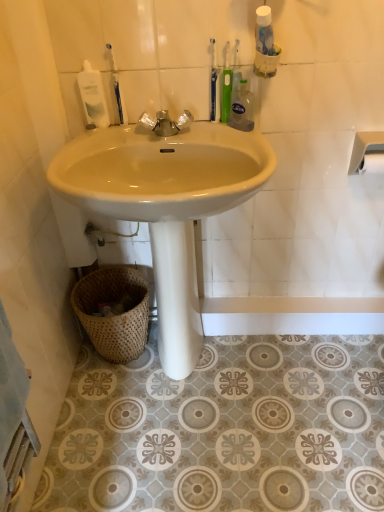
The image size is (384, 512). Describe the element at coordinates (166, 123) in the screenshot. I see `matte silver faucet at center` at that location.

Describe the element at coordinates (166, 205) in the screenshot. This screenshot has width=384, height=512. I see `matte ceramic sink at center` at that location.

At what (x,y) coordinates should I click in order to perform the action: click on clear liquid soap at upper center. Please return your answer as a coordinate pair (x, y). The image size is (384, 512). Looking at the image, I should click on (242, 108).

Looking at this image, does clear liquid soap at upper center appear on the left side of blue plastic toothbrush at upper left, marked as the first toothbrush in a left-to-right arrangement?

No, clear liquid soap at upper center is not to the left of blue plastic toothbrush at upper left, marked as the first toothbrush in a left-to-right arrangement.

Does clear liquid soap at upper center have a smaller size compared to blue plastic toothbrush at upper left, marked as the first toothbrush in a left-to-right arrangement?

No, clear liquid soap at upper center is not smaller than blue plastic toothbrush at upper left, marked as the first toothbrush in a left-to-right arrangement.

How much distance is there between clear liquid soap at upper center and blue plastic toothbrush at upper left, which ranks as the fourth toothbrush in right-to-left order?

14.19 inches.

Can you tell me how much clear liquid soap at upper center and blue plastic toothbrush at upper left, which ranks as the fourth toothbrush in right-to-left order, differ in facing direction?

48.4 degrees separate the facing orientations of clear liquid soap at upper center and blue plastic toothbrush at upper left, which ranks as the fourth toothbrush in right-to-left order.

How different are the orientations of clear liquid soap at upper center and green plastic toothbrush at upper center, positioned as the 2th toothbrush in right-to-left order, in degrees?

The facing directions of clear liquid soap at upper center and green plastic toothbrush at upper center, positioned as the 2th toothbrush in right-to-left order, are 44.9 degrees apart.

Is clear liquid soap at upper center positioned with its back to green plastic toothbrush at upper center, the third toothbrush when ordered from left to right?

No, clear liquid soap at upper center is not facing away from green plastic toothbrush at upper center, the third toothbrush when ordered from left to right.

Would you say clear liquid soap at upper center is outside green plastic toothbrush at upper center, positioned as the 2th toothbrush in right-to-left order?

Yes, clear liquid soap at upper center is outside of green plastic toothbrush at upper center, positioned as the 2th toothbrush in right-to-left order.

Is clear liquid soap at upper center closer to camera compared to green plastic toothbrush at upper center, positioned as the 2th toothbrush in right-to-left order?

Yes, clear liquid soap at upper center is closer to the viewer.

Which is nearer, (376, 156) or (234, 68)?

Point (376, 156).

Between white matte toilet paper at right and green plastic toothbrush at upper center, which is the 4th toothbrush from left to right, which one appears on the left side from the viewer's perspective?

green plastic toothbrush at upper center, which is the 4th toothbrush from left to right.

From a real-world perspective, is white matte toilet paper at right positioned over green plastic toothbrush at upper center, positioned as the 1th toothbrush in right-to-left order, based on gravity?

No, from a real-world perspective, white matte toilet paper at right is not over green plastic toothbrush at upper center, positioned as the 1th toothbrush in right-to-left order

Considering the relative sizes of blue plastic toothbrush at upper left, marked as the first toothbrush in a left-to-right arrangement, and clear liquid soap at upper center in the image provided, is blue plastic toothbrush at upper left, marked as the first toothbrush in a left-to-right arrangement, shorter than clear liquid soap at upper center?

No, blue plastic toothbrush at upper left, marked as the first toothbrush in a left-to-right arrangement, is not shorter than clear liquid soap at upper center.

Can you tell me how much blue plastic toothbrush at upper left, which ranks as the fourth toothbrush in right-to-left order, and clear liquid soap at upper center differ in facing direction?

The angle between the facing direction of blue plastic toothbrush at upper left, which ranks as the fourth toothbrush in right-to-left order, and the facing direction of clear liquid soap at upper center is 48.4 degrees.

Could you measure the distance between blue plastic toothbrush at upper left, marked as the first toothbrush in a left-to-right arrangement, and clear liquid soap at upper center?

blue plastic toothbrush at upper left, marked as the first toothbrush in a left-to-right arrangement, is 14.19 inches away from clear liquid soap at upper center.

From the image's perspective, between blue plastic toothbrush at upper left, marked as the first toothbrush in a left-to-right arrangement, and clear liquid soap at upper center, who is located below?

clear liquid soap at upper center appears lower in the image.

Considering the relative sizes of matte silver faucet at center and woven brown basket at lower left in the image provided, is matte silver faucet at center thinner than woven brown basket at lower left?

Correct, the width of matte silver faucet at center is less than that of woven brown basket at lower left.

Does matte silver faucet at center appear on the right side of woven brown basket at lower left?

Correct, you'll find matte silver faucet at center to the right of woven brown basket at lower left.

Does matte silver faucet at center turn towards woven brown basket at lower left?

No, matte silver faucet at center does not turn towards woven brown basket at lower left.

Which object is closer to the camera, matte silver faucet at center or woven brown basket at lower left?

matte silver faucet at center is closer to the camera.

Does blue plastic toothbrush at upper center, the third toothbrush from the right, have a larger size compared to clear liquid soap at upper center?

No.

Between blue plastic toothbrush at upper center, which is the second toothbrush from left to right, and clear liquid soap at upper center, which one appears on the right side from the viewer's perspective?

From the viewer's perspective, clear liquid soap at upper center appears more on the right side.

This screenshot has height=512, width=384. In order to click on the 2nd toothbrush directly above the clear liquid soap at upper center (from a real-world perspective) in this screenshot , I will do `click(214, 85)`.

Considering the relative sizes of matte silver faucet at center and green plastic toothbrush at upper center, the third toothbrush when ordered from left to right, in the image provided, is matte silver faucet at center thinner than green plastic toothbrush at upper center, the third toothbrush when ordered from left to right,?

No.

From a real-world perspective, who is located lower, matte silver faucet at center or green plastic toothbrush at upper center, the third toothbrush when ordered from left to right?

matte silver faucet at center is physically lower.

Is matte silver faucet at center looking in the opposite direction of green plastic toothbrush at upper center, positioned as the 2th toothbrush in right-to-left order?

No.

Is matte silver faucet at center to the left of green plastic toothbrush at upper center, positioned as the 2th toothbrush in right-to-left order, from the viewer's perspective?

Yes.

The width and height of the screenshot is (384, 512). In order to click on the 1st toothbrush directly above the clear liquid soap at upper center (from a real-world perspective) in this screenshot , I will do `click(115, 90)`.

I want to click on cleaning product below the green plastic toothbrush at upper center, the third toothbrush when ordered from left to right (from a real-world perspective), so click(242, 108).

Based on their spatial positions, is green plastic toothbrush at upper center, the third toothbrush when ordered from left to right, or matte ceramic sink at center closer to white matte toilet paper at right?

green plastic toothbrush at upper center, the third toothbrush when ordered from left to right, is closer to white matte toilet paper at right.

From the picture: When comparing their distances from blue plastic toothbrush at upper center, the third toothbrush from the right, does matte silver faucet at center or white plastic towel bar at upper right seem further?

The object further to blue plastic toothbrush at upper center, the third toothbrush from the right, is white plastic towel bar at upper right.

Looking at this image, estimate the real-world distances between objects in this image. Which object is further from white matte toilet paper at right, green plastic toothbrush at upper center, positioned as the 2th toothbrush in right-to-left order, or white glossy mouthwash at upper left?

white glossy mouthwash at upper left.

From the image, which object appears to be farther from blue plastic toothbrush at upper center, the third toothbrush from the right, matte silver faucet at center or white matte toilet paper at right?

Based on the image, white matte toilet paper at right appears to be further to blue plastic toothbrush at upper center, the third toothbrush from the right.

When comparing their distances from white matte toilet paper at right, does matte ceramic sink at center or green plastic toothbrush at upper center, which is the 4th toothbrush from left to right, seem closer?

green plastic toothbrush at upper center, which is the 4th toothbrush from left to right, is positioned closer to the anchor white matte toilet paper at right.

Estimate the real-world distances between objects in this image. Which object is closer to clear liquid soap at upper center, white plastic towel bar at upper right or blue plastic toothbrush at upper left, which ranks as the fourth toothbrush in right-to-left order?

Based on the image, blue plastic toothbrush at upper left, which ranks as the fourth toothbrush in right-to-left order, appears to be nearer to clear liquid soap at upper center.

Based on their spatial positions, is white glossy mouthwash at upper left or white matte toilet paper at right further from green plastic toothbrush at upper center, positioned as the 2th toothbrush in right-to-left order?

white matte toilet paper at right is further to green plastic toothbrush at upper center, positioned as the 2th toothbrush in right-to-left order.

Based on their spatial positions, is white plastic towel bar at upper right or green plastic toothbrush at upper center, the third toothbrush when ordered from left to right, further from matte ceramic sink at center?

white plastic towel bar at upper right.

Find the location of a particular element. The width and height of the screenshot is (384, 512). sink between blue plastic toothbrush at upper left, marked as the first toothbrush in a left-to-right arrangement, and white matte toilet paper at right from left to right is located at coordinates (166, 205).

At what (x,y) coordinates should I click in order to perform the action: click on mouthwash between blue plastic toothbrush at upper center, the third toothbrush from the right, and matte ceramic sink at center vertically. Please return your answer as a coordinate pair (x, y). The width and height of the screenshot is (384, 512). Looking at the image, I should click on (93, 97).

At what (x,y) coordinates should I click in order to perform the action: click on cleaning product located between green plastic toothbrush at upper center, positioned as the 1th toothbrush in right-to-left order, and white plastic towel bar at upper right in the left-right direction. Please return your answer as a coordinate pair (x, y). This screenshot has width=384, height=512. Looking at the image, I should click on (242, 108).

What are the coordinates of `sink between white glossy mouthwash at upper left and woven brown basket at lower left vertically` in the screenshot? It's located at (166, 205).